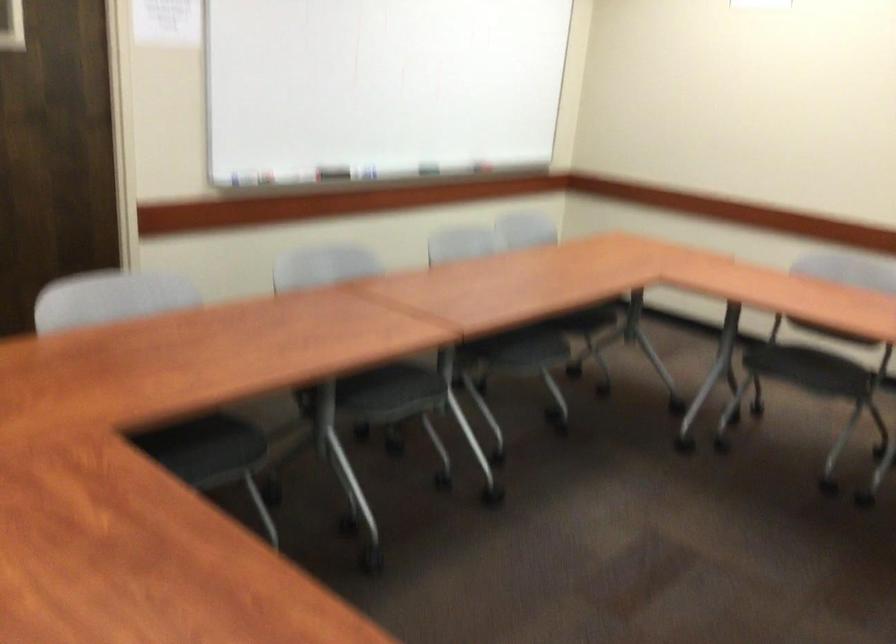
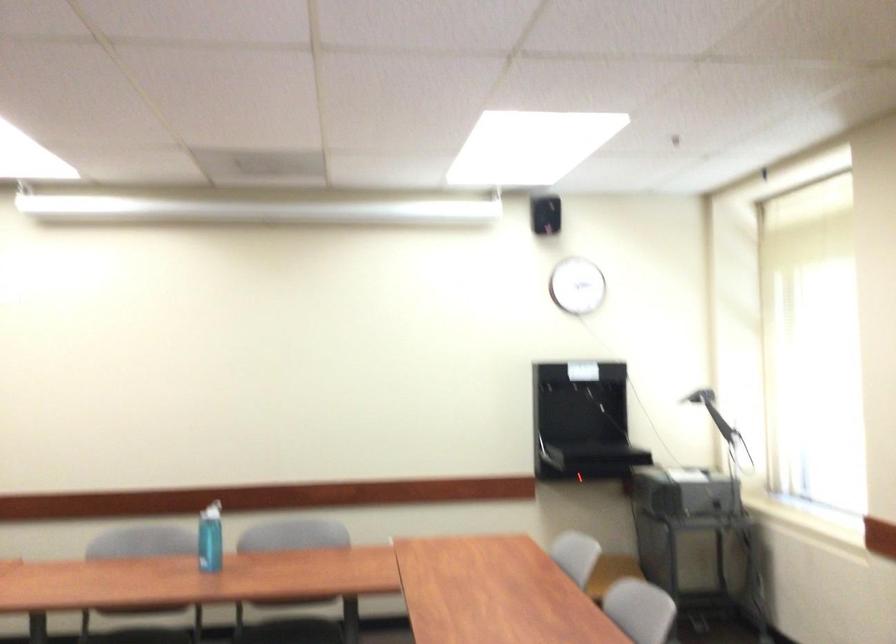
Question: Based on the continuous images, in which direction is the camera rotating? Reply with the corresponding letter.

Choices:
 (A) Left
 (B) Right
 (C) Up
 (D) Down

Answer: (B)